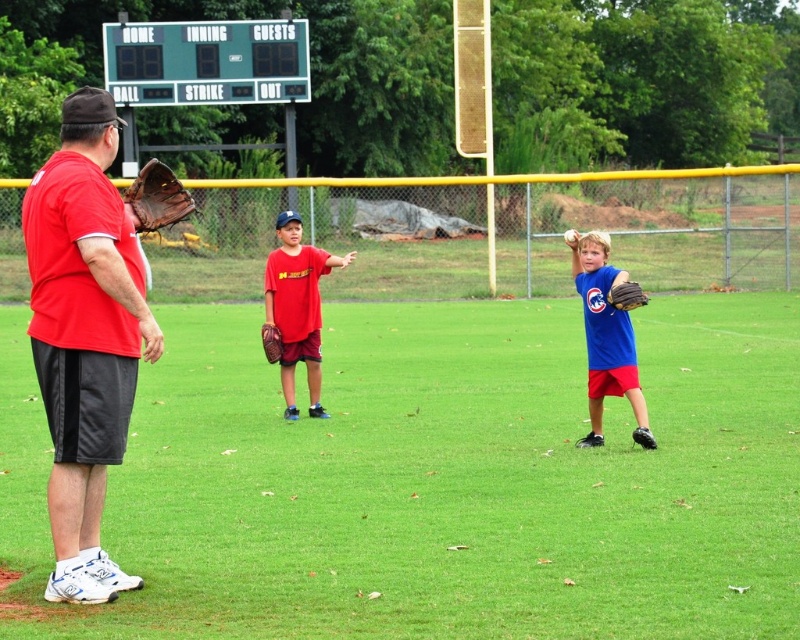
Who is more distant from viewer, (258,56) or (617,292)?

The point (258,56) is more distant.

Is green plastic scoreboard at upper center wider than brown leather glove at right?

Yes.

In order to click on green plastic scoreboard at upper center in this screenshot , I will do `click(206, 61)`.

How far apart are green grass at center and matte red shirt at center?

green grass at center and matte red shirt at center are 4.20 meters apart.

The image size is (800, 640). Identify the location of green grass at center. (460, 480).

The width and height of the screenshot is (800, 640). Identify the location of green grass at center. (460, 480).

Find the location of a particular element. This screenshot has height=640, width=800. green grass at center is located at coordinates (460, 480).

In order to click on green grass at center in this screenshot , I will do `click(460, 480)`.

Where is `green grass at center`? green grass at center is located at coordinates [460, 480].